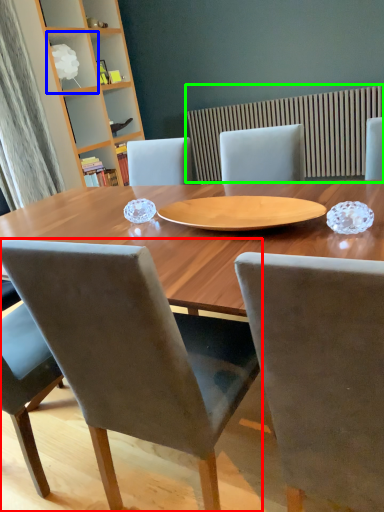
Question: Estimate the real-world distances between objects in this image. Which object is closer to chair (highlighted by a red box), shelf (highlighted by a blue box) or radiator (highlighted by a green box)?

Choices:
 (A) shelf
 (B) radiator

Answer: (B)